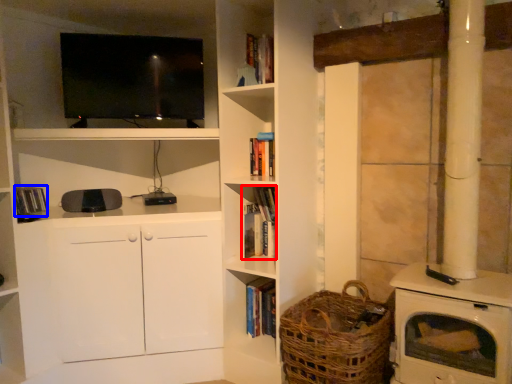
Question: Among these objects, which one is nearest to the camera, book (highlighted by a red box) or book (highlighted by a blue box)?

Choices:
 (A) book
 (B) book

Answer: (B)